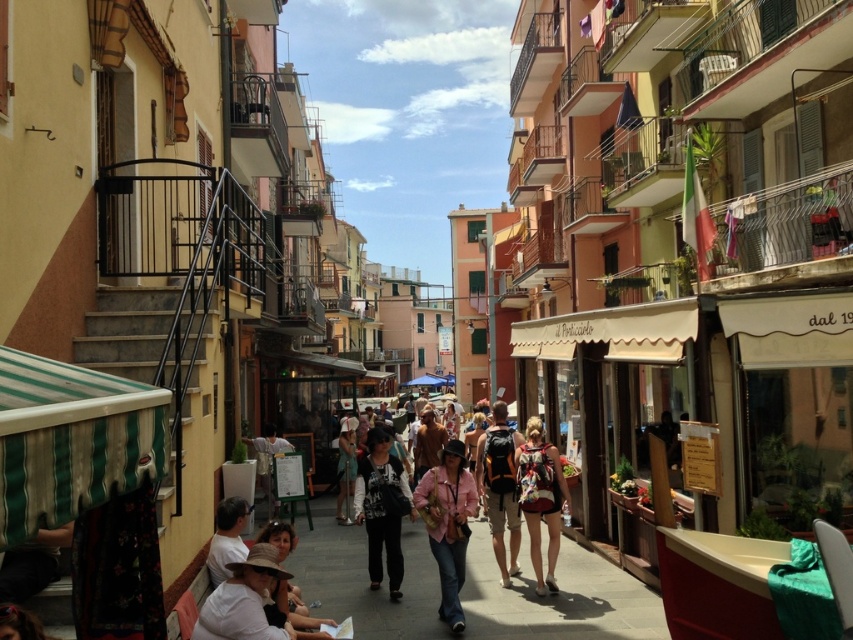
You are a tourist walking down this charming Mediterranean street and notice two items of clothing. You see the dark gray fabric pants at center and the matte brown hat at lower left. Which item is positioned further to the right in this scene?

The dark gray fabric pants at center are positioned to the right of the matte brown hat at lower left, so the dark gray fabric pants at center are further to the right.

You are a traveler standing in the middle of this lively Mediterranean street. You notice two items at the center of the scene. Which item is wider, the dark gray fabric pants at center or the red backpack at center?

The dark gray fabric pants at center is wider than the red backpack at center according to the description provided.